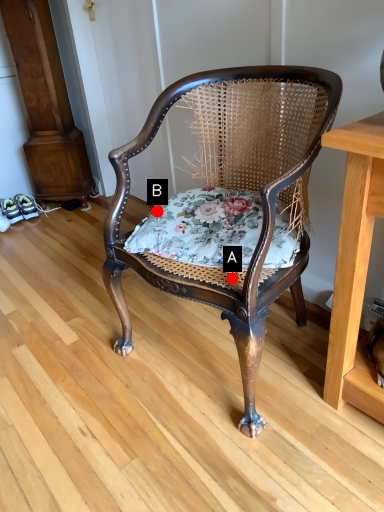
Question: Two points are circled on the image, labeled by A and B beside each circle. Which of the following is the farthest from the observer?

Choices:
 (A) A is further
 (B) B is further

Answer: (B)